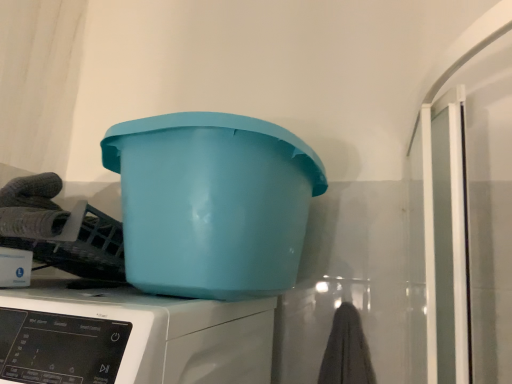
This screenshot has width=512, height=384. What do you see at coordinates (212, 203) in the screenshot?
I see `matte plastic bucket at center` at bounding box center [212, 203].

This screenshot has height=384, width=512. Find the location of `matte plastic bucket at center`. matte plastic bucket at center is located at coordinates (212, 203).

In order to click on matte plastic bucket at center in this screenshot , I will do click(212, 203).